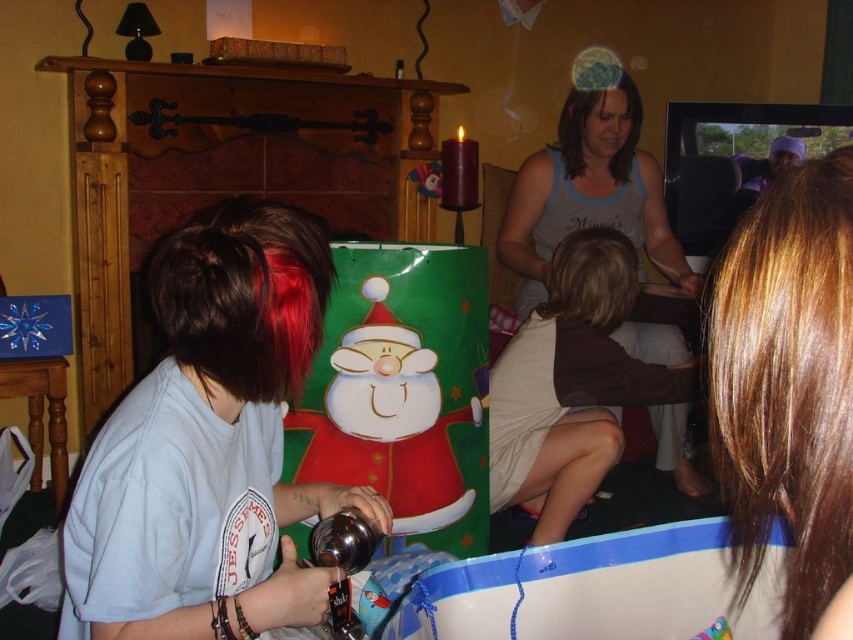
You are a photographer setting up for a group photo. You need to position the light blue cotton shirt at left and the gray tank top at center so that both are visible in the frame. Considering their heights, which person should you place closer to the camera to avoid blocking the other?

The light blue cotton shirt at left is shorter than the gray tank top at center. To prevent the taller gray tank top at center from blocking the shorter light blue cotton shirt at left, position the shorter light blue cotton shirt at left closer to the camera.

You are standing in the room and want to reach the point at coordinates (799, 529). If your arm can extend 16 inches, can you reach it?

The point at coordinates (799, 529) is 18.15 inches away from the camera, which is beyond your arm extension of 16 inches. You cannot reach it.